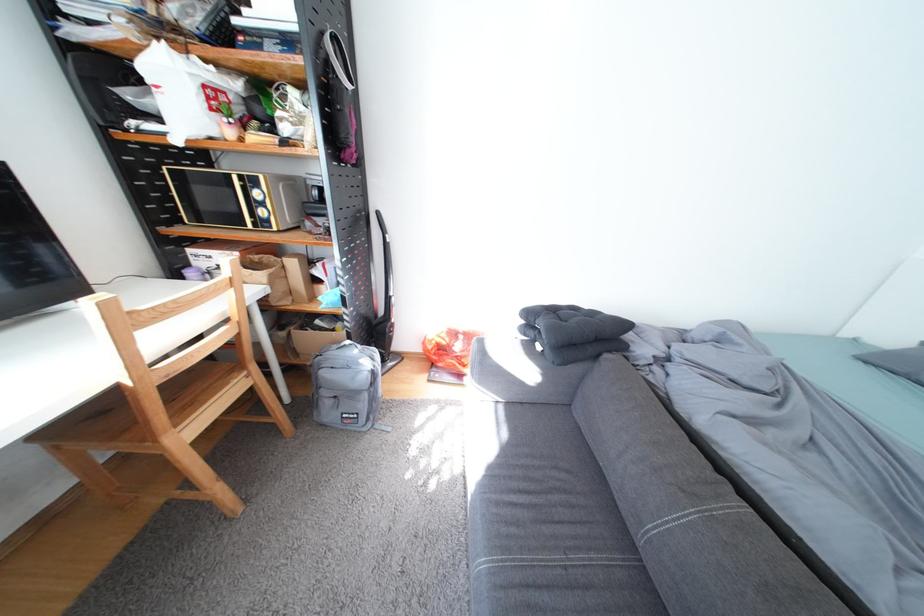
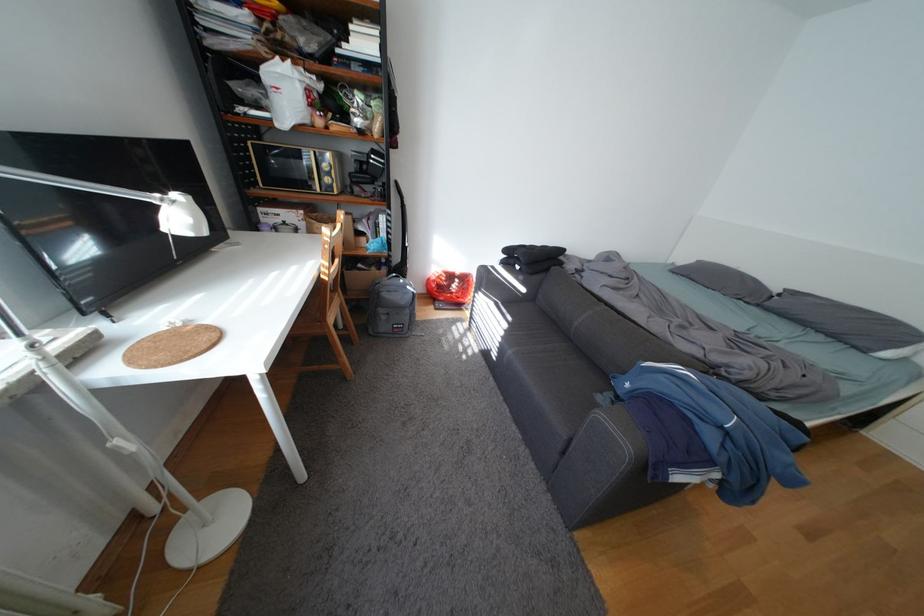
Question: Based on the continuous images, in which direction is the camera rotating? Reply with the corresponding letter.

Choices:
 (A) Left
 (B) Right
 (C) Up
 (D) Down

Answer: (B)